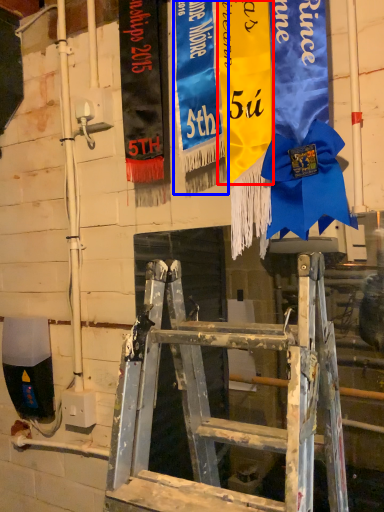
Question: Among these objects, which one is nearest to the camera, tapestry (highlighted by a red box) or tapestry (highlighted by a blue box)?

Choices:
 (A) tapestry
 (B) tapestry

Answer: (A)